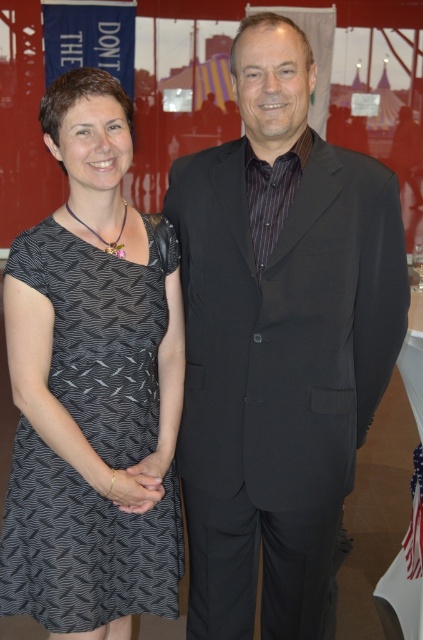
Question: Does black matte suit at center appear on the left side of black printed fabric dress at left?

Choices:
 (A) yes
 (B) no

Answer: (B)

Question: Among these points, which one is nearest to the camera?

Choices:
 (A) (189, 392)
 (B) (134, 532)

Answer: (B)

Question: Among these points, which one is nearest to the camera?

Choices:
 (A) (145, 298)
 (B) (216, 598)

Answer: (A)

Question: Which object appears farthest from the camera in this image?

Choices:
 (A) black printed fabric dress at left
 (B) black matte suit at center

Answer: (A)

Question: Is black matte suit at center closer to camera compared to black printed fabric dress at left?

Choices:
 (A) yes
 (B) no

Answer: (A)

Question: Can you confirm if black matte suit at center is thinner than black printed fabric dress at left?

Choices:
 (A) yes
 (B) no

Answer: (B)